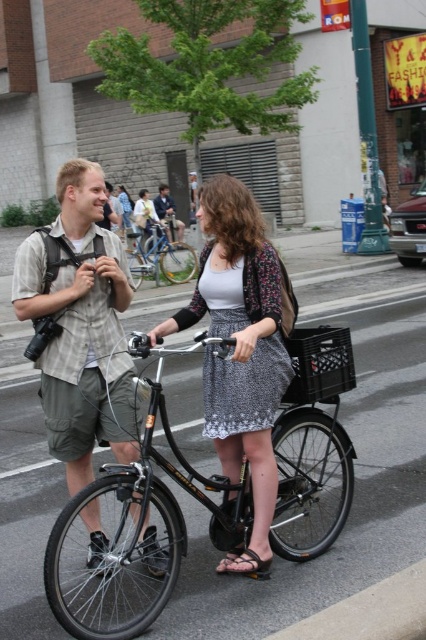
Question: Is black matte bicycle at center smaller than denim jacket at center?

Choices:
 (A) no
 (B) yes

Answer: (A)

Question: Based on their relative distances, which object is nearer to the matte khaki shirt at center?

Choices:
 (A) silver metallic bicycle at center
 (B) matte khaki shirt at left
 (C) black matte bicycle at center
 (D) denim jacket at center

Answer: (C)

Question: Which object is the closest to the patterned fabric skirt at center?

Choices:
 (A) matte khaki shirt at center
 (B) silver metallic bicycle at center
 (C) black matte bicycle at center

Answer: (C)

Question: Does matte khaki shirt at center appear on the right side of black matte bicycle at center?

Choices:
 (A) no
 (B) yes

Answer: (A)

Question: Estimate the real-world distances between objects in this image. Which object is farther from the matte khaki shirt at center?

Choices:
 (A) silver metallic bicycle at center
 (B) printed cotton dress at center
 (C) black matte bicycle at center

Answer: (A)

Question: Is patterned fabric skirt at center bigger than printed cotton dress at center?

Choices:
 (A) yes
 (B) no

Answer: (A)